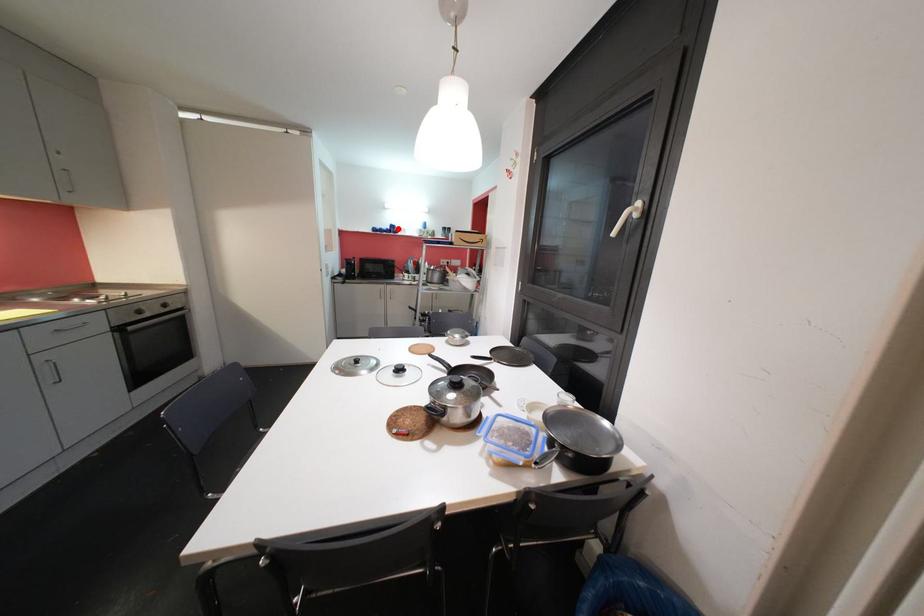
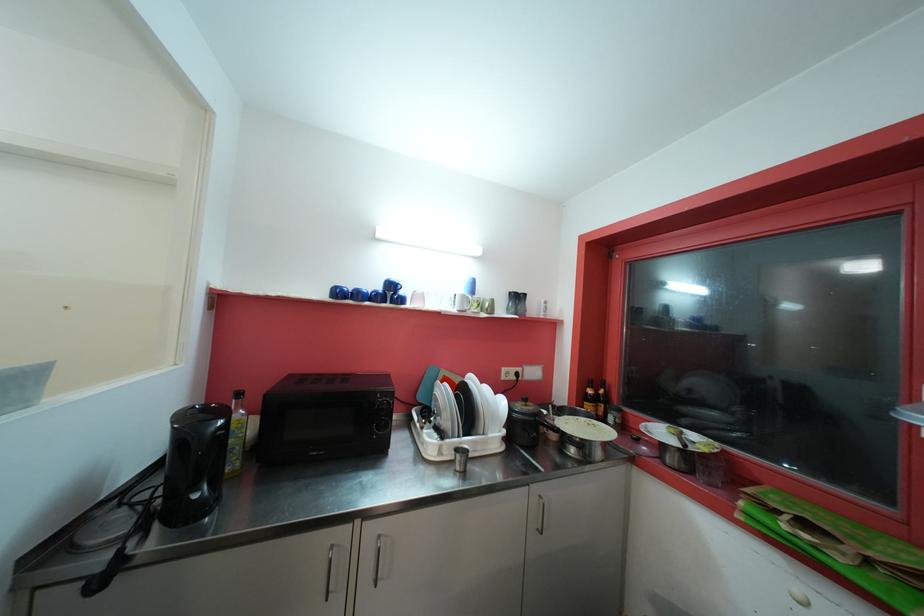
Where in the second image is the point corresponding to the highlighted location from the first image?

(396, 288)